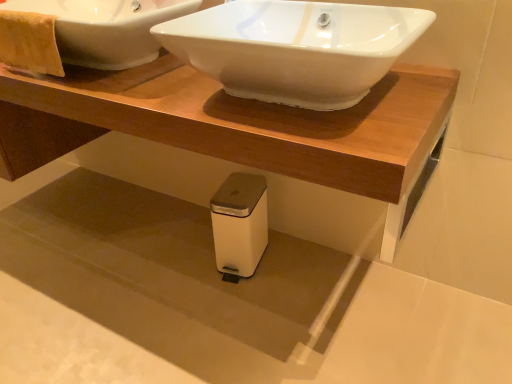
Image resolution: width=512 pixels, height=384 pixels. What are the coordinates of `free point in front of yellow textured towel at upper left` in the screenshot? It's located at (48, 86).